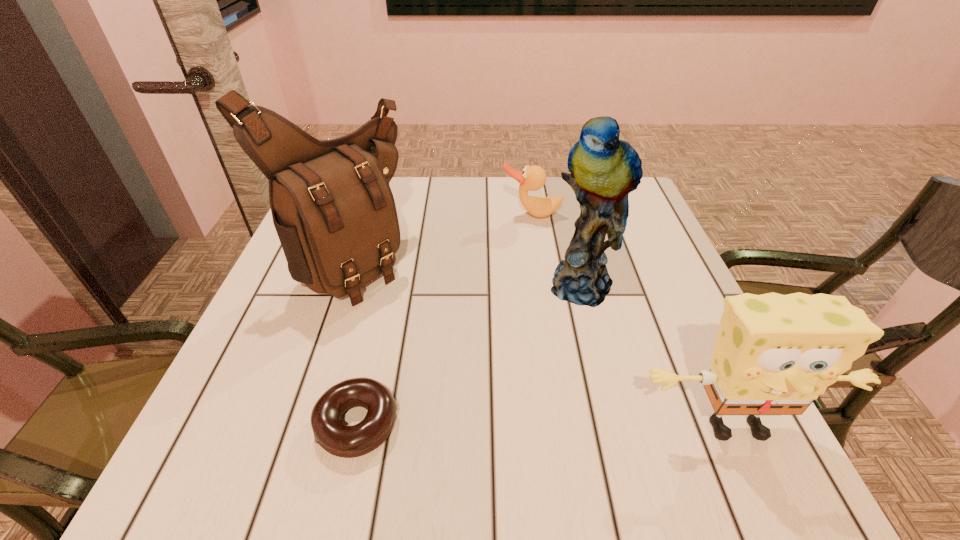
Locate an element on the screen. Image resolution: width=960 pixels, height=540 pixels. free location that satisfies the following two spatial constraints: 1. on the back side of the shoulder bag; 2. on the left side of the fourth tallest object is located at coordinates (364, 214).